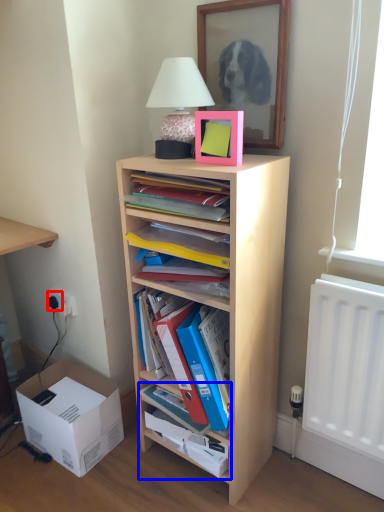
Question: Which object appears closest to the camera in this image, electric outlet (highlighted by a red box) or cabinet (highlighted by a blue box)?

Choices:
 (A) electric outlet
 (B) cabinet

Answer: (B)